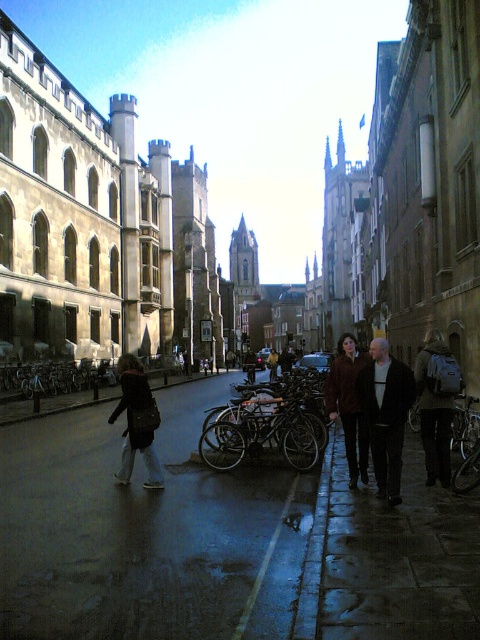
Question: Which point is closer to the camera taking this photo?

Choices:
 (A) pos(352,436)
 (B) pos(356,580)

Answer: (B)

Question: Can you confirm if shiny metallic bicycles at center is positioned to the right of dark gray backpack at right?

Choices:
 (A) no
 (B) yes

Answer: (A)

Question: Among these objects, which one is farthest from the camera?

Choices:
 (A) shiny concrete pavement at center
 (B) denim jacket at lower left
 (C) dark gray stone pavement at lower right
 (D) shiny metallic bicycles at center

Answer: (D)

Question: Which object is the farthest from the dark gray backpack at right?

Choices:
 (A) shiny metallic bicycles at center
 (B) dark brown leather jacket at center

Answer: (A)

Question: Can you confirm if dark gray stone pavement at lower right is positioned above dark gray backpack at right?

Choices:
 (A) yes
 (B) no

Answer: (B)

Question: Is dark brown leather jacket at right wider than dark gray backpack at right?

Choices:
 (A) no
 (B) yes

Answer: (A)